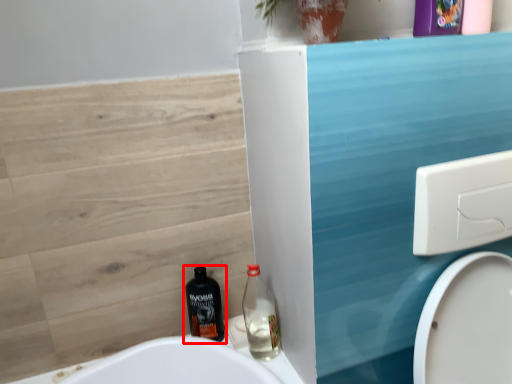
Question: In this image, where is bottle (annotated by the red box) located relative to bottle?

Choices:
 (A) right
 (B) left

Answer: (B)